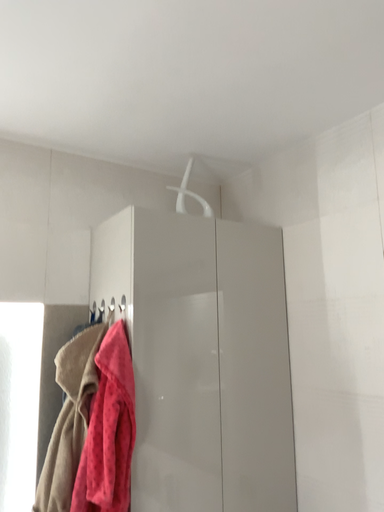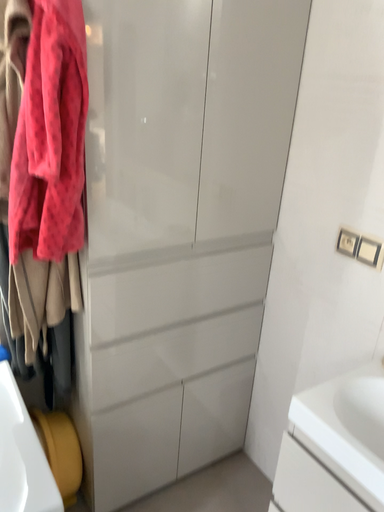
Question: How did the camera likely rotate when shooting the video?

Choices:
 (A) rotated upward
 (B) rotated downward

Answer: (B)